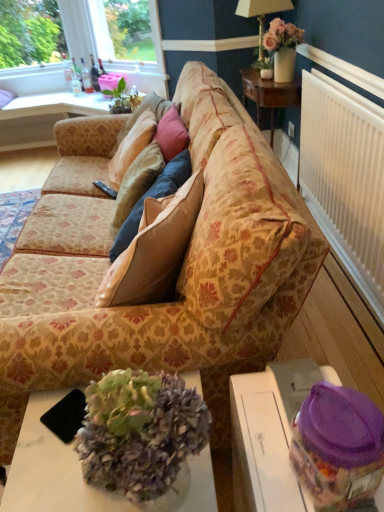
Question: Considering the relative positions of translucent plastic container at lower right, acting as the first table starting from the right, and white marble desk at center in the image provided, is translucent plastic container at lower right, acting as the first table starting from the right, to the right of white marble desk at center from the viewer's perspective?

Choices:
 (A) yes
 (B) no

Answer: (A)

Question: From the image's perspective, is translucent plastic container at lower right, which ranks as the 2th table in top-to-bottom order, located beneath white marble desk at center?

Choices:
 (A) yes
 (B) no

Answer: (B)

Question: Considering the relative sizes of translucent plastic container at lower right, the second table viewed from the left, and white marble desk at center in the image provided, is translucent plastic container at lower right, the second table viewed from the left, thinner than white marble desk at center?

Choices:
 (A) yes
 (B) no

Answer: (A)

Question: From the image's perspective, would you say translucent plastic container at lower right, which is the first table in front-to-back order, is positioned over white marble desk at center?

Choices:
 (A) no
 (B) yes

Answer: (B)

Question: Is white marble desk at center a part of translucent plastic container at lower right, which is the first table in front-to-back order?

Choices:
 (A) yes
 (B) no

Answer: (B)

Question: Considering the relative sizes of translucent plastic container at lower right, acting as the first table starting from the right, and white marble desk at center in the image provided, is translucent plastic container at lower right, acting as the first table starting from the right, wider than white marble desk at center?

Choices:
 (A) yes
 (B) no

Answer: (B)

Question: From a real-world perspective, is translucent plastic container at lower right, which is the first table in front-to-back order, on pink matte vase at upper right?

Choices:
 (A) no
 (B) yes

Answer: (A)

Question: Considering the relative positions of translucent plastic container at lower right, acting as the first table starting from the right, and pink matte vase at upper right in the image provided, is translucent plastic container at lower right, acting as the first table starting from the right, in front of pink matte vase at upper right?

Choices:
 (A) yes
 (B) no

Answer: (A)

Question: Are translucent plastic container at lower right, the second table viewed from the left, and pink matte vase at upper right making contact?

Choices:
 (A) yes
 (B) no

Answer: (B)

Question: Could you tell me if translucent plastic container at lower right, placed as the 2th table when sorted from back to front, is facing pink matte vase at upper right?

Choices:
 (A) yes
 (B) no

Answer: (B)

Question: Is translucent plastic container at lower right, the second table viewed from the left, bigger than pink matte vase at upper right?

Choices:
 (A) yes
 (B) no

Answer: (A)

Question: Does translucent plastic container at lower right, which is the first table in front-to-back order, have a lesser height compared to pink matte vase at upper right?

Choices:
 (A) yes
 (B) no

Answer: (B)

Question: Does pink matte vase at upper right turn towards floral-patterned fabric couch at center?

Choices:
 (A) no
 (B) yes

Answer: (B)